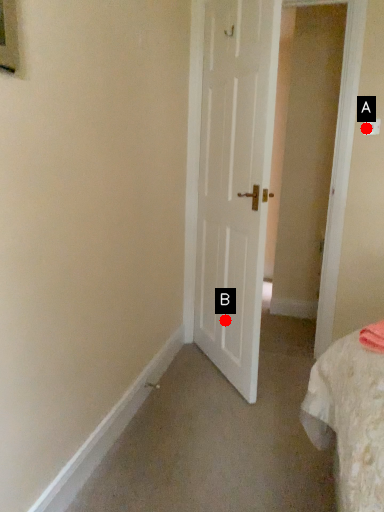
Question: Two points are circled on the image, labeled by A and B beside each circle. Which of the following is the farthest from the observer?

Choices:
 (A) A is further
 (B) B is further

Answer: (B)